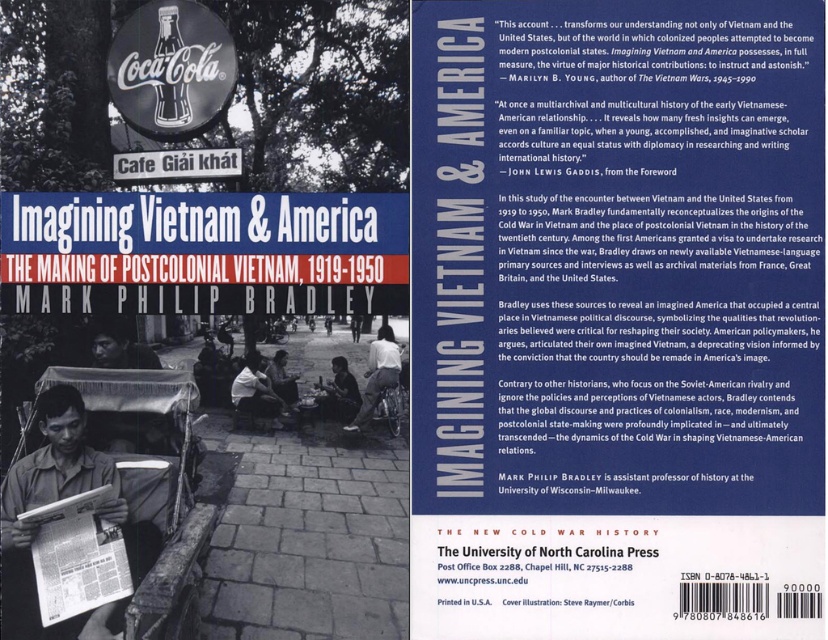
What are the coordinates of the white paper magazine at center in the left panel of the book cover?

The white paper magazine at center is located at coordinates point [76,556].